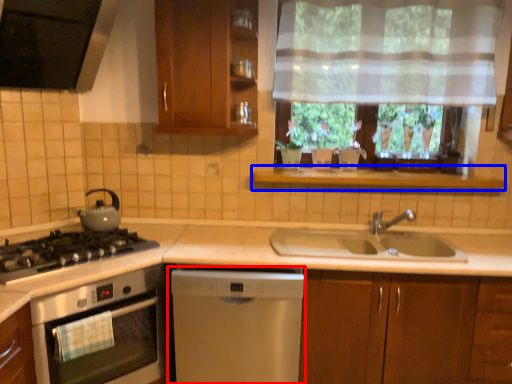
Question: Which object appears farthest to the camera in this image, dishwasher (highlighted by a red box) or window sill (highlighted by a blue box)?

Choices:
 (A) dishwasher
 (B) window sill

Answer: (B)